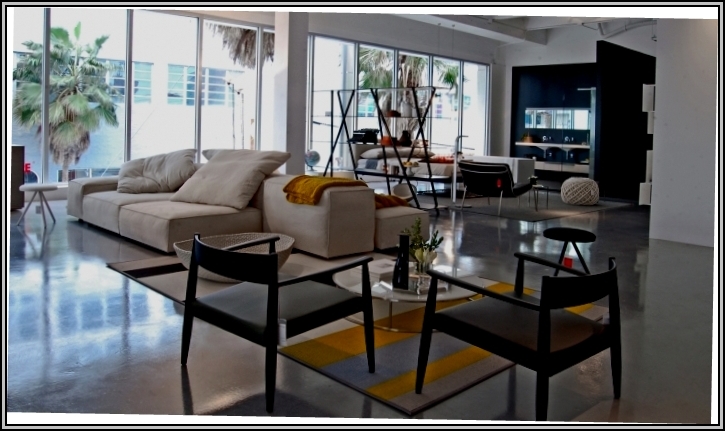
Identify the location of picture of a lounge. This screenshot has height=431, width=725. (357, 181).